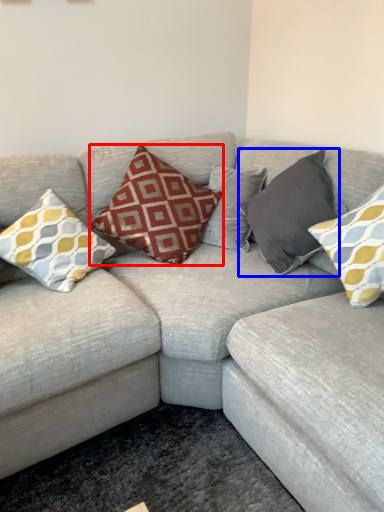
Question: Which object is further to the camera taking this photo, pillow (highlighted by a red box) or pillow (highlighted by a blue box)?

Choices:
 (A) pillow
 (B) pillow

Answer: (A)